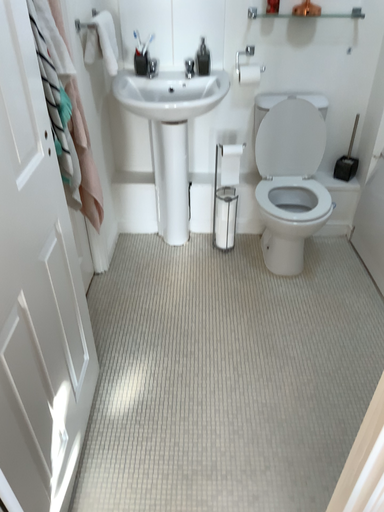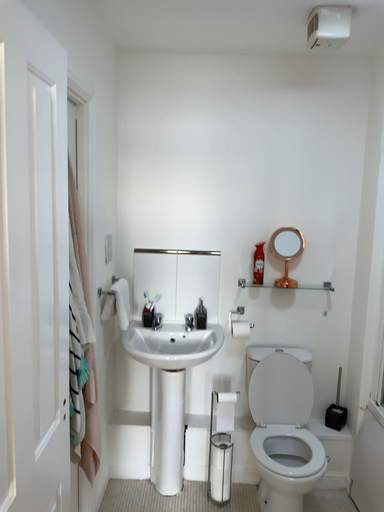
Question: Which way did the camera rotate in the video?

Choices:
 (A) rotated upward
 (B) rotated downward

Answer: (A)